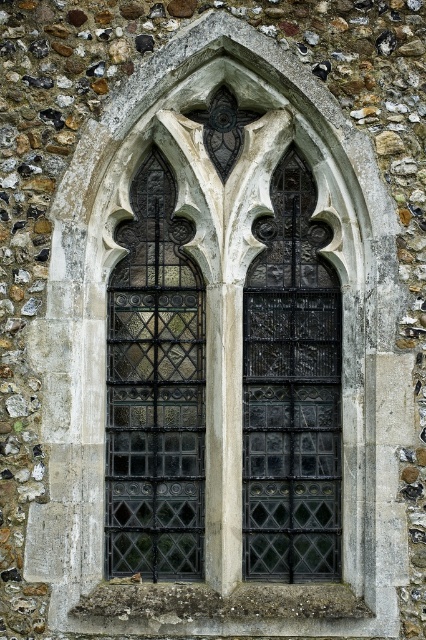
Question: Which object appears closest to the camera in this image?

Choices:
 (A) dark stained glass at left
 (B) black textured glass at center

Answer: (B)

Question: Can you confirm if dark stained glass at left is positioned to the left of black textured glass at center?

Choices:
 (A) yes
 (B) no

Answer: (A)

Question: Observing the image, what is the correct spatial positioning of dark stained glass at left in reference to black textured glass at center?

Choices:
 (A) above
 (B) below

Answer: (A)

Question: Does dark stained glass at left have a lesser width compared to black textured glass at center?

Choices:
 (A) yes
 (B) no

Answer: (B)

Question: Which point appears closest to the camera in this image?

Choices:
 (A) (331, 477)
 (B) (152, 209)

Answer: (A)